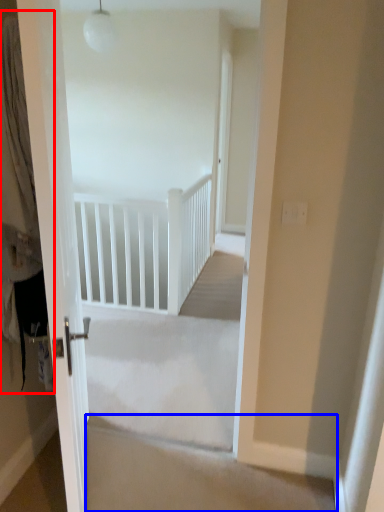
Question: Among these objects, which one is farthest to the camera, curtain (highlighted by a red box) or stairwell (highlighted by a blue box)?

Choices:
 (A) curtain
 (B) stairwell

Answer: (B)